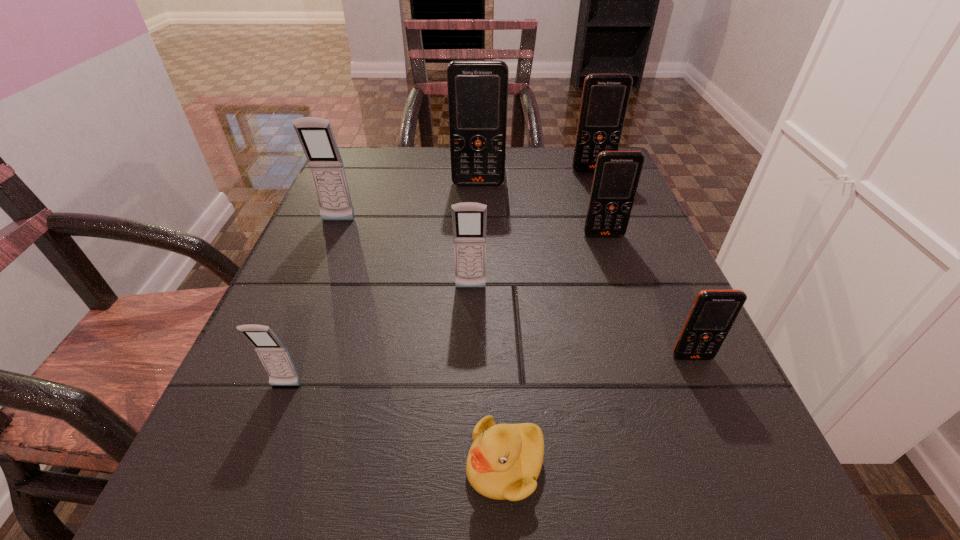
In the image, there is a desktop. Identify the location of free region at the right edge. This screenshot has width=960, height=540. (634, 251).

Where is `vacant space at the far left corner`? This screenshot has width=960, height=540. vacant space at the far left corner is located at coordinates (373, 174).

Identify the location of vacant area at the near right corner. Image resolution: width=960 pixels, height=540 pixels. (637, 483).

Image resolution: width=960 pixels, height=540 pixels. Identify the location of vacant point located between the second smallest orange cellular telephone and the leftmost orange cellular telephone. (541, 210).

At what (x,y) coordinates should I click in order to perform the action: click on vacant space that is in between the second biggest orange cellular telephone and the duckling. Please return your answer as a coordinate pair (x, y). Looking at the image, I should click on (548, 318).

Locate an element on the screen. empty space that is in between the third farthest cellular telephone and the nearest object is located at coordinates (421, 343).

Identify the location of vacant space that's between the rightmost gray cellular telephone and the fifth nearest object. This screenshot has height=540, width=960. (538, 262).

The image size is (960, 540). In order to click on vacant area that lies between the second smallest orange cellular telephone and the second farthest gray cellular telephone in this screenshot , I will do `click(538, 262)`.

The width and height of the screenshot is (960, 540). Find the location of `blank region between the nearest object and the sixth farthest cellular telephone`. blank region between the nearest object and the sixth farthest cellular telephone is located at coordinates (598, 411).

The width and height of the screenshot is (960, 540). In order to click on free space between the farthest object and the second nearest cellular telephone in this screenshot , I will do click(x=642, y=264).